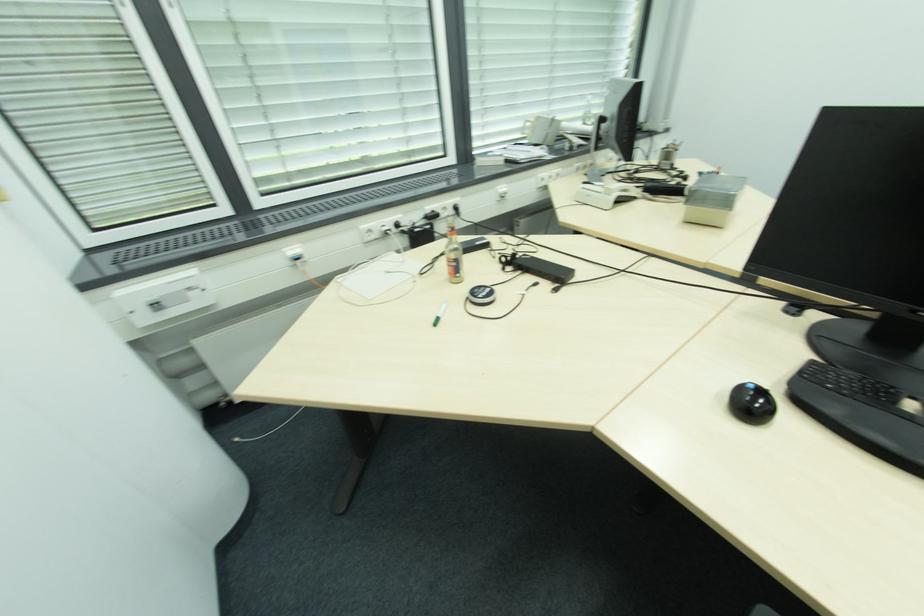
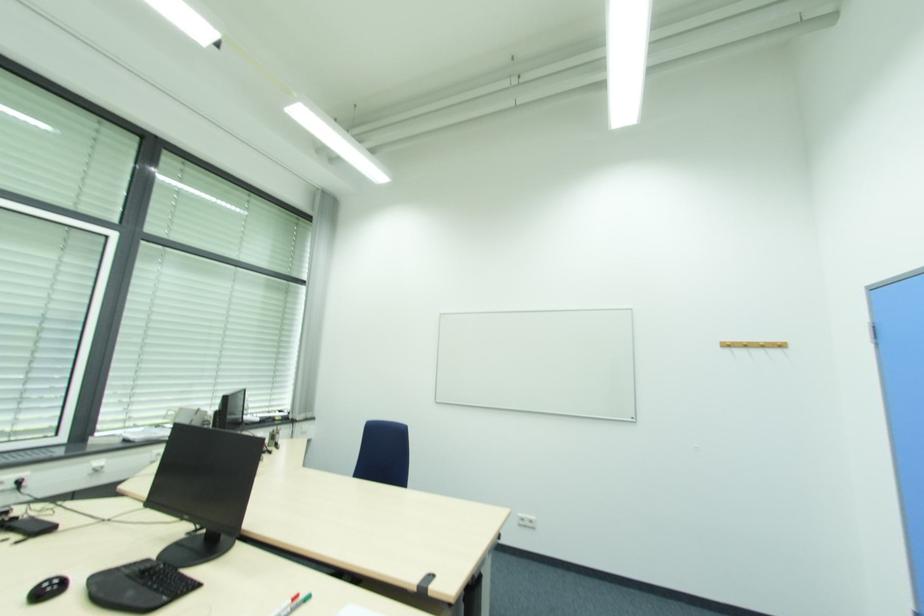
In the second image, find the point that corresponds to (456,213) in the first image.

(17, 487)